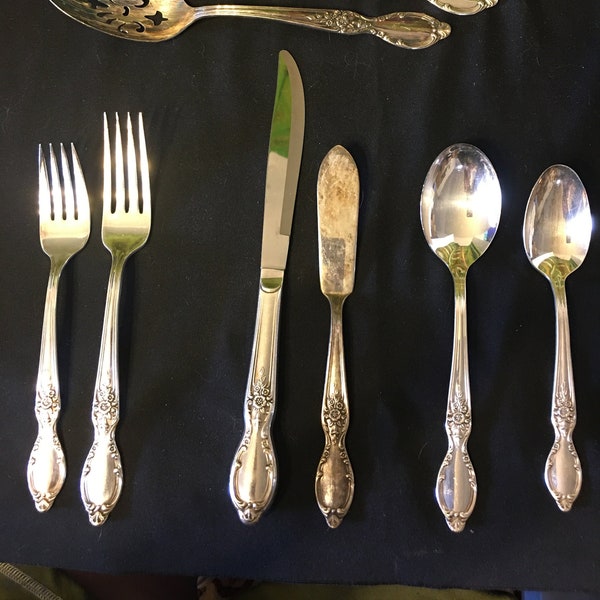
You are a GUI agent. You are given a task and a screenshot of the screen. Output one action in this format:
    pyautogui.click(x=<x>, y=<y>)
    Task: Click on the pieces of silverware
    The height and width of the screenshot is (600, 600).
    Given the screenshot: What is the action you would take?
    pyautogui.click(x=554, y=417), pyautogui.click(x=460, y=9), pyautogui.click(x=432, y=22), pyautogui.click(x=551, y=217), pyautogui.click(x=463, y=220), pyautogui.click(x=341, y=221), pyautogui.click(x=272, y=223), pyautogui.click(x=123, y=217), pyautogui.click(x=67, y=226)